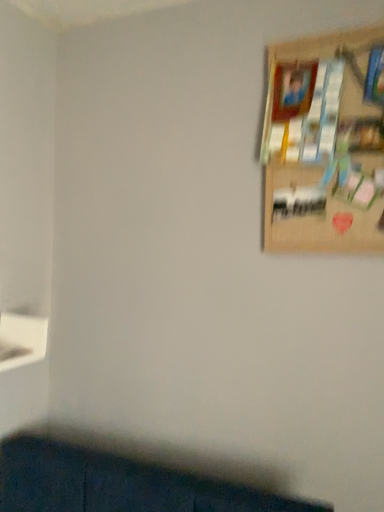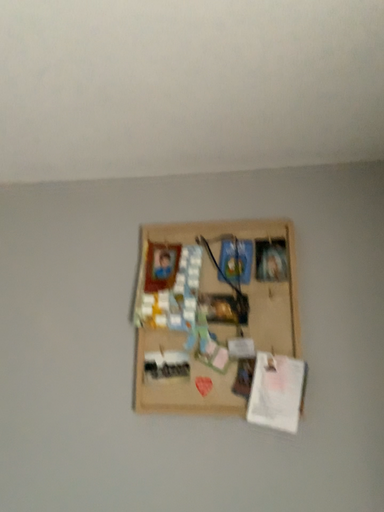
Question: Which way did the camera rotate in the video?

Choices:
 (A) rotated downward
 (B) rotated upward

Answer: (B)